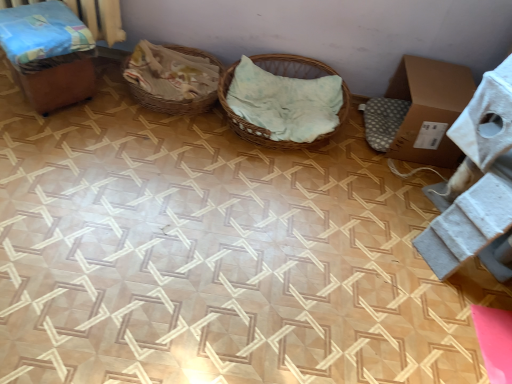
Find the location of `vacant space that is in between woven wood basket at center, positioned as the 1th basket in right-to-left order, and brown cardboard box at right`. vacant space that is in between woven wood basket at center, positioned as the 1th basket in right-to-left order, and brown cardboard box at right is located at coordinates (366, 144).